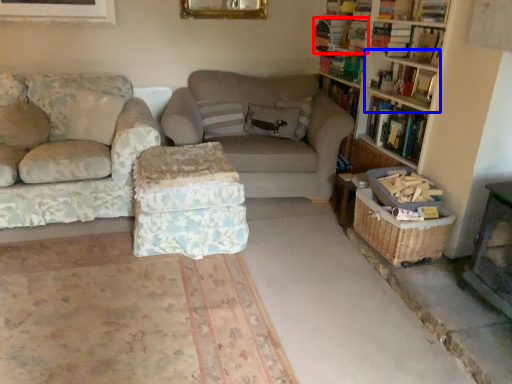
Question: Which point is further to the camera, book (highlighted by a red box) or shelf (highlighted by a blue box)?

Choices:
 (A) book
 (B) shelf

Answer: (A)